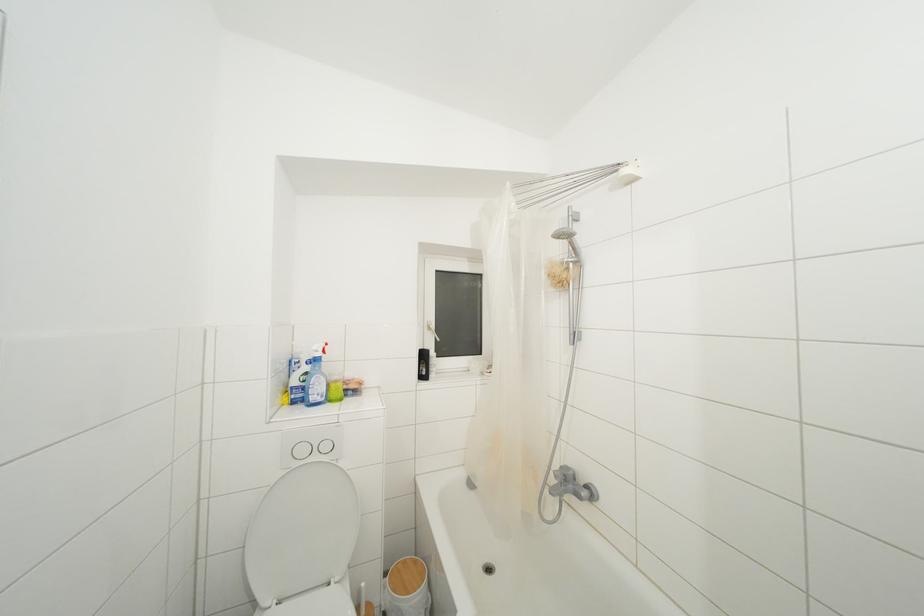
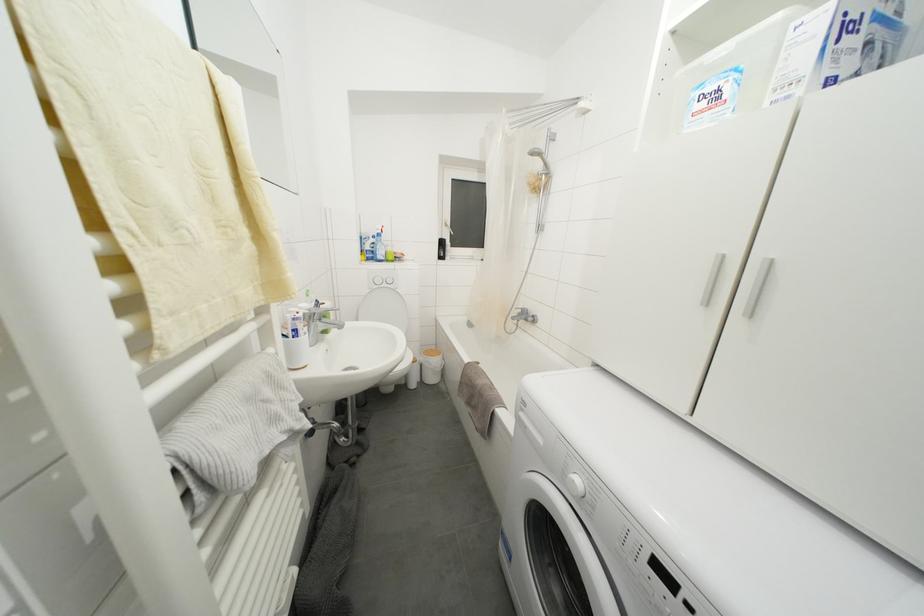
Question: The images are taken continuously from a first-person perspective. In which direction are you moving?

Choices:
 (A) Left
 (B) Right
 (C) Forward
 (D) Backward

Answer: (D)